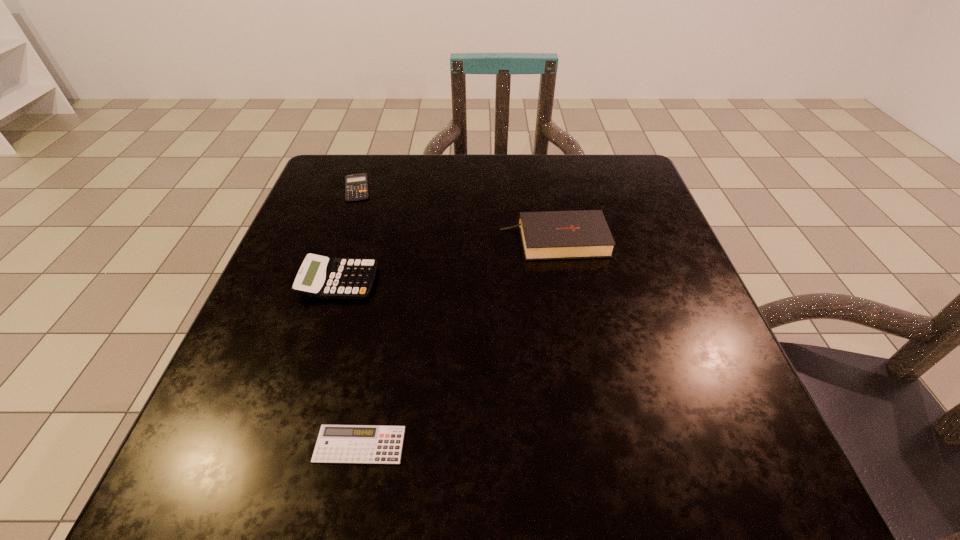
Where is `vacant space in between the second nearest calculator and the nearest object`? vacant space in between the second nearest calculator and the nearest object is located at coordinates (349, 363).

Image resolution: width=960 pixels, height=540 pixels. What are the coordinates of `vacant region between the farthest object and the Bible` in the screenshot? It's located at (455, 214).

The image size is (960, 540). What are the coordinates of `free space between the rightmost object and the third farthest object` in the screenshot? It's located at (446, 261).

The height and width of the screenshot is (540, 960). What are the coordinates of `object identified as the third closest to the shortest object` in the screenshot? It's located at (356, 185).

Select which object is the closest to the tallest object. Please provide its 2D coordinates. Your answer should be formatted as a tuple, i.e. [(x, y)], where the tuple contains the x and y coordinates of a point satisfying the conditions above.

[(319, 276)]

The height and width of the screenshot is (540, 960). I want to click on calculator identified as the closest to the nearest calculator, so click(319, 276).

In order to click on calculator that is the nearest to the third tallest object in this screenshot , I will do `click(319, 276)`.

At what (x,y) coordinates should I click in order to perform the action: click on blank area in the image that satisfies the following two spatial constraints: 1. on the front side of the nearest calculator; 2. on the right side of the second shortest object. Please return your answer as a coordinate pair (x, y). Image resolution: width=960 pixels, height=540 pixels. Looking at the image, I should click on (267, 444).

Image resolution: width=960 pixels, height=540 pixels. I want to click on vacant space that satisfies the following two spatial constraints: 1. on the front side of the tallest object; 2. on the right side of the second tallest calculator, so click(x=339, y=241).